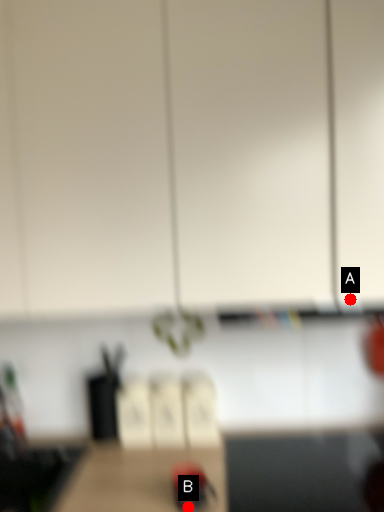
Question: Two points are circled on the image, labeled by A and B beside each circle. Which point is closer to the camera?

Choices:
 (A) A is closer
 (B) B is closer

Answer: (B)